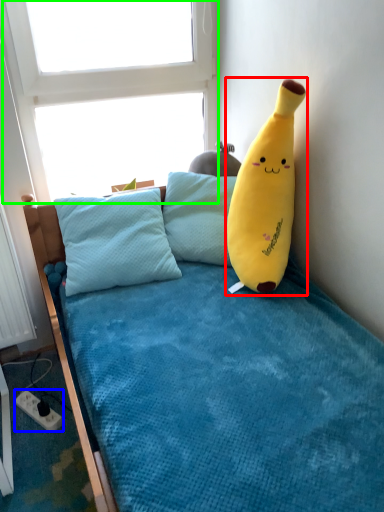
Question: Which is nearer to the toy (highlighted by a red box)? power outlet (highlighted by a blue box) or window screen (highlighted by a green box).

Choices:
 (A) power outlet
 (B) window screen

Answer: (B)